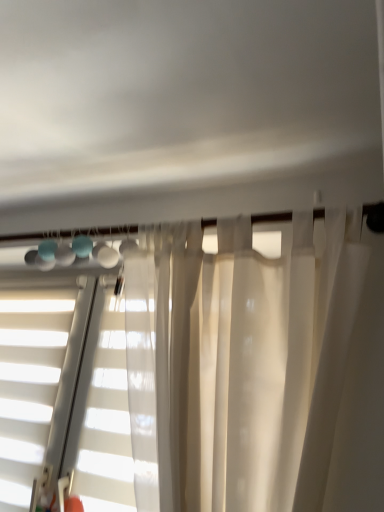
Question: Does point (6, 402) appear closer or farther from the camera than point (66, 432)?

Choices:
 (A) closer
 (B) farther

Answer: (B)

Question: From their relative heights in the image, would you say white matte blinds at left is taller or shorter than translucent white blinds at center?

Choices:
 (A) tall
 (B) short

Answer: (A)

Question: From a real-world perspective, relative to translucent white blinds at center, is white matte blinds at left vertically above or below?

Choices:
 (A) below
 (B) above

Answer: (A)

Question: From the image's perspective, relative to white matte blinds at left, is translucent white blinds at center above or below?

Choices:
 (A) above
 (B) below

Answer: (A)

Question: Does point (33, 493) appear closer or farther from the camera than point (9, 302)?

Choices:
 (A) closer
 (B) farther

Answer: (A)

Question: Is translucent white blinds at center to the left or to the right of white matte blinds at left in the image?

Choices:
 (A) left
 (B) right

Answer: (B)

Question: In terms of width, does translucent white blinds at center look wider or thinner when compared to white matte blinds at left?

Choices:
 (A) thin
 (B) wide

Answer: (A)